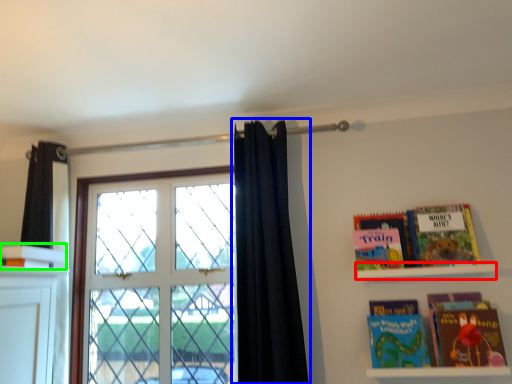
Question: Based on their relative distances, which object is nearer to shelf (highlighted by a red box)? Choose from curtain (highlighted by a blue box) and book (highlighted by a green box).

Choices:
 (A) curtain
 (B) book

Answer: (A)